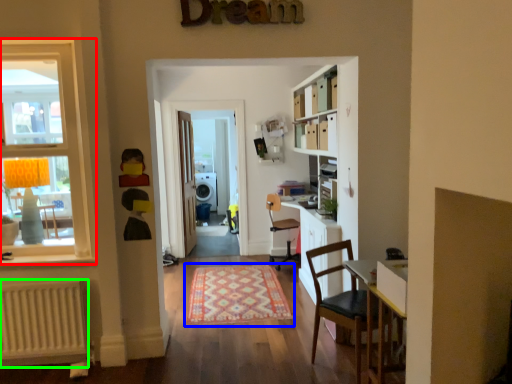
Question: Which object is the closest to the window (highlighted by a red box)? Choose among these: mat (highlighted by a blue box) or radiator (highlighted by a green box).

Choices:
 (A) mat
 (B) radiator

Answer: (B)